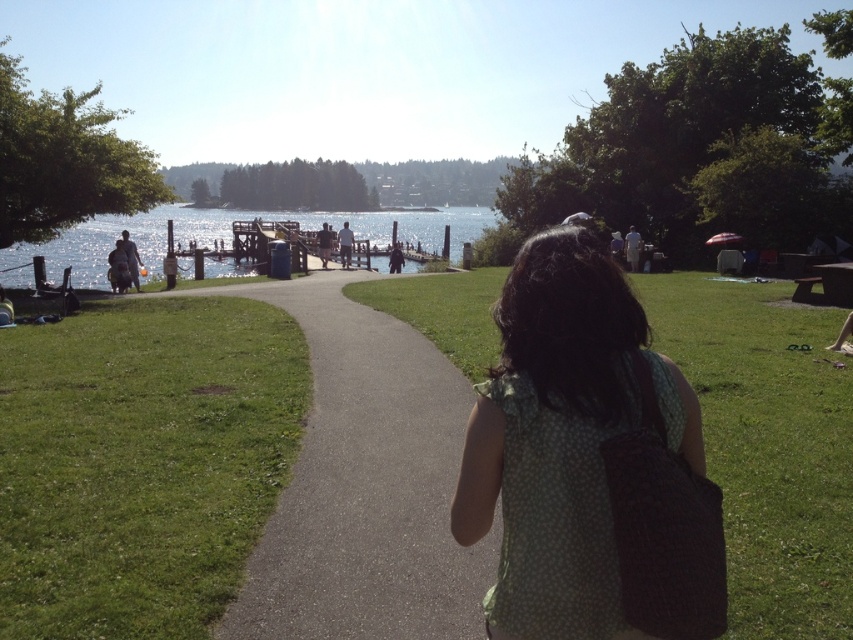
Question: From the image, what is the correct spatial relationship of dark gray fabric bag at left in relation to dark blue jeans at left?

Choices:
 (A) above
 (B) below

Answer: (B)

Question: Which point appears farthest from the camera in this image?

Choices:
 (A) (120, 250)
 (B) (354, 550)
 (C) (338, 237)
 (D) (126, 264)

Answer: (C)

Question: Based on their relative distances, which object is farther from the white cotton shirt at center?

Choices:
 (A) light blue shirt at center
 (B) green dotted dress at center

Answer: (B)

Question: Is asphalt path at center smaller than dark blue jeans at left?

Choices:
 (A) no
 (B) yes

Answer: (B)

Question: Observing the image, what is the correct spatial positioning of asphalt path at center in reference to dark blue jeans at left?

Choices:
 (A) right
 (B) left

Answer: (A)

Question: Which of the following is the closest to the observer?

Choices:
 (A) dark blue jeans at left
 (B) asphalt path at center
 (C) dark gray fabric bag at left

Answer: (B)